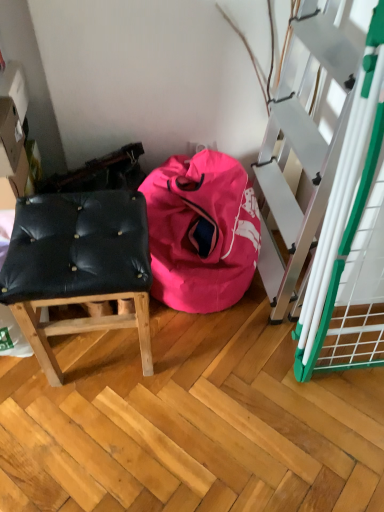
Question: Based on their sizes in the image, would you say black leather stool at left is bigger or smaller than pink fabric bean bag at center?

Choices:
 (A) big
 (B) small

Answer: (B)

Question: In the image, is black leather stool at left on the left side or the right side of pink fabric bean bag at center?

Choices:
 (A) left
 (B) right

Answer: (A)

Question: Considering the positions of black leather stool at left and pink fabric bean bag at center in the image, is black leather stool at left wider or thinner than pink fabric bean bag at center?

Choices:
 (A) wide
 (B) thin

Answer: (B)

Question: In the image, is pink fabric bean bag at center positioned in front of or behind black leather stool at left?

Choices:
 (A) behind
 (B) front

Answer: (A)

Question: From a real-world perspective, is pink fabric bean bag at center physically located above or below black leather stool at left?

Choices:
 (A) above
 (B) below

Answer: (B)

Question: Considering the positions of point pos(208,254) and point pos(94,233), is point pos(208,254) closer or farther from the camera than point pos(94,233)?

Choices:
 (A) farther
 (B) closer

Answer: (A)

Question: Considering the positions of pink fabric bean bag at center and black leather stool at left in the image, is pink fabric bean bag at center bigger or smaller than black leather stool at left?

Choices:
 (A) big
 (B) small

Answer: (A)